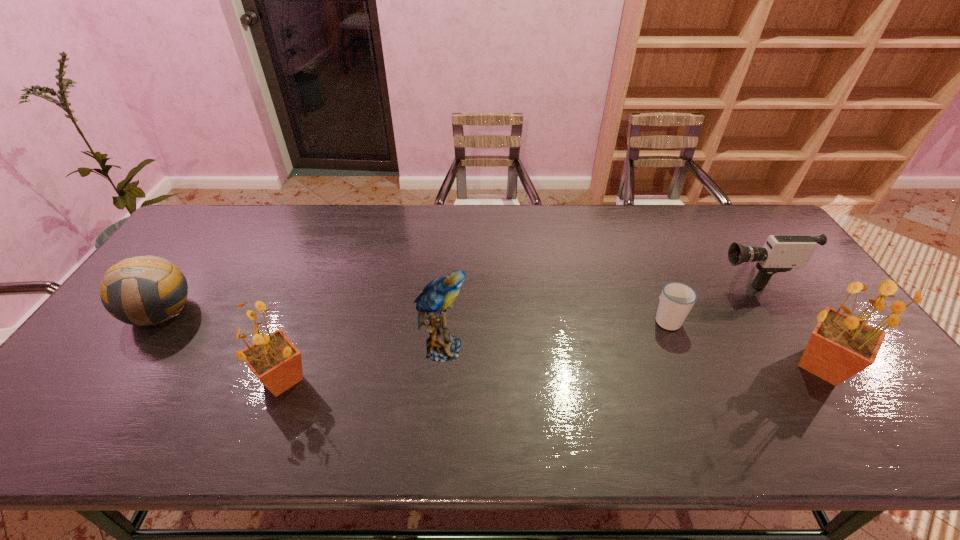
Locate an element on the screen. This screenshot has height=540, width=960. empty space between the leftmost object and the taller sunflower is located at coordinates (491, 339).

Find the location of a particular element. Image resolution: width=960 pixels, height=540 pixels. vacant area between the leftmost object and the right sunflower is located at coordinates (491, 339).

Image resolution: width=960 pixels, height=540 pixels. I want to click on empty location between the third object from left to right and the camcorder, so click(x=596, y=311).

Find the location of a particular element. free space between the second object from left to right and the fourth object from right to left is located at coordinates (363, 364).

Locate an element on the screen. The width and height of the screenshot is (960, 540). vacant area between the cup and the leftmost object is located at coordinates (414, 315).

Identify the location of empty space that is in between the second object from left to right and the camcorder. Image resolution: width=960 pixels, height=540 pixels. (516, 327).

This screenshot has height=540, width=960. I want to click on object that is the fifth closest to the cup, so (144, 290).

Locate an element on the screen. This screenshot has width=960, height=540. object that is the closest to the right sunflower is located at coordinates (780, 253).